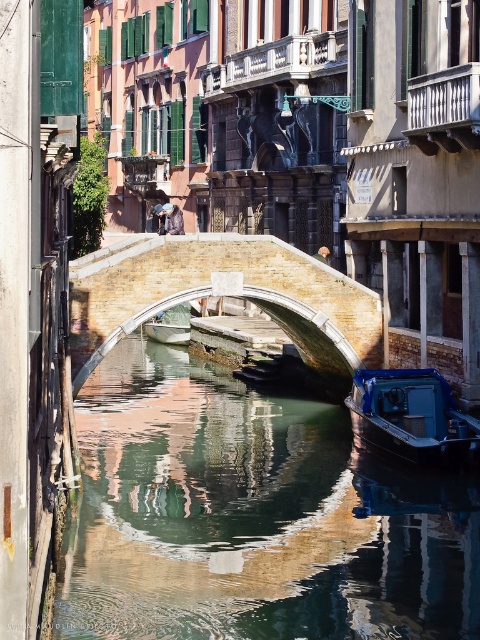
You are standing on the arched bridge in the canal scene. You notice two points marked in the image. One is at coordinate point (x=421, y=433) and the other at point (x=188, y=332). Which point is nearer to your current position on the bridge?

Point (x=421, y=433) is closer to the camera than point (x=188, y=332), so the point at (x=421, y=433) is nearer to your position on the bridge.

You are standing on the bridge and looking down at the canal. You notice two points marked on the water surface. The first point is at coordinate point[317,596] and the second is at point[170,285]. Which point is closer to your current position on the bridge?

Point[317,596] is closer to the camera than point[170,285], so the first point is closer to your position on the bridge.

You are standing on the arched bridge and see a point marked at coordinates [412,417]. What object is located at that point?

The point at coordinates [412,417] corresponds to the blue plastic boat at lower right.